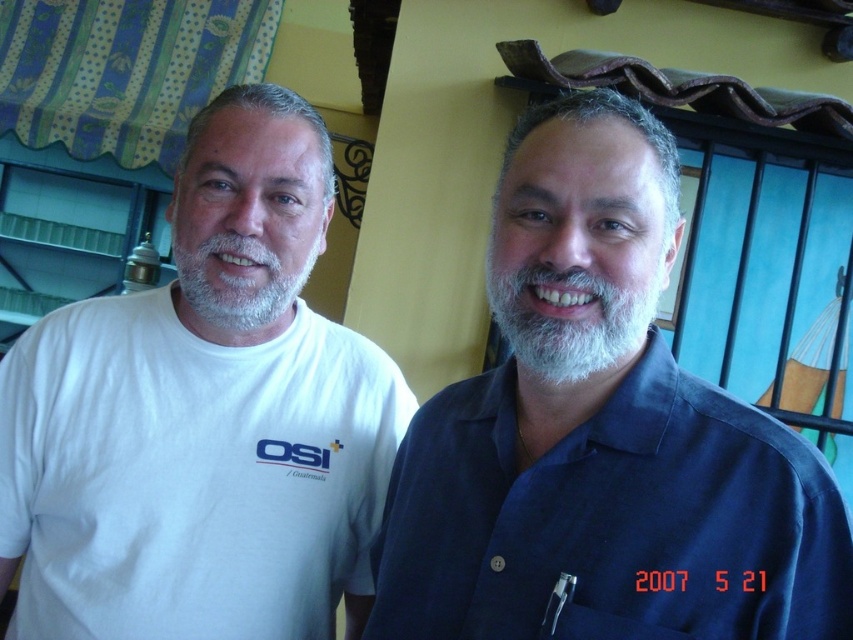
Does blue smooth shirt at center appear on the right side of white cotton t-shirt at left?

Yes, blue smooth shirt at center is to the right of white cotton t-shirt at left.

Who is more forward, [688,412] or [173,326]?

Point [688,412] is more forward.

Where is `blue smooth shirt at center`? blue smooth shirt at center is located at coordinates (601, 435).

Which of these two, white cotton t-shirt at left or gray/soft hair at center, stands shorter?

gray/soft hair at center is shorter.

Describe the element at coordinates (204, 417) in the screenshot. I see `white cotton t-shirt at left` at that location.

Identify the location of white cotton t-shirt at left. The image size is (853, 640). (204, 417).

Does gray/soft hair at center come behind grayhairbeard at left?

No, it is in front of grayhairbeard at left.

Does gray/soft hair at center have a lesser width compared to grayhairbeard at left?

Indeed, gray/soft hair at center has a lesser width compared to grayhairbeard at left.

Does point (619, 339) come in front of point (236, 307)?

That is True.

This screenshot has height=640, width=853. What are the coordinates of `gray/soft hair at center` in the screenshot? It's located at (572, 320).